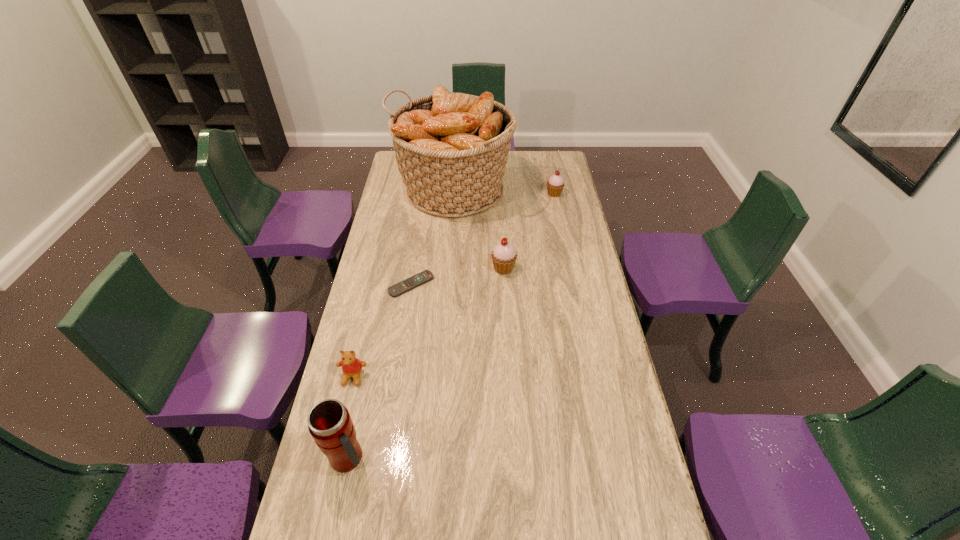
Where is `object that is at the right edge`? Image resolution: width=960 pixels, height=540 pixels. object that is at the right edge is located at coordinates (555, 184).

This screenshot has width=960, height=540. What are the coordinates of `object situated at the far left corner` in the screenshot? It's located at click(451, 149).

Find the location of a particular element. This screenshot has height=540, width=960. vacant position at the far edge of the desktop is located at coordinates (521, 155).

Identify the location of free spot at the near edge of the desktop. (531, 537).

Identify the location of free space at the left edge. The width and height of the screenshot is (960, 540). (370, 281).

The height and width of the screenshot is (540, 960). What are the coordinates of `vacant region at the right edge of the desktop` in the screenshot? It's located at (625, 428).

The image size is (960, 540). Identify the location of vacant area that lies between the nearer cupcake and the thermos bottle. (426, 363).

Identify the location of free space that is in between the teddy bear and the shortest object. (382, 330).

In order to click on free space that is in between the teddy bear and the left cupcake in this screenshot , I will do `click(428, 322)`.

The width and height of the screenshot is (960, 540). I want to click on empty location between the second nearest object and the remote control, so point(382,330).